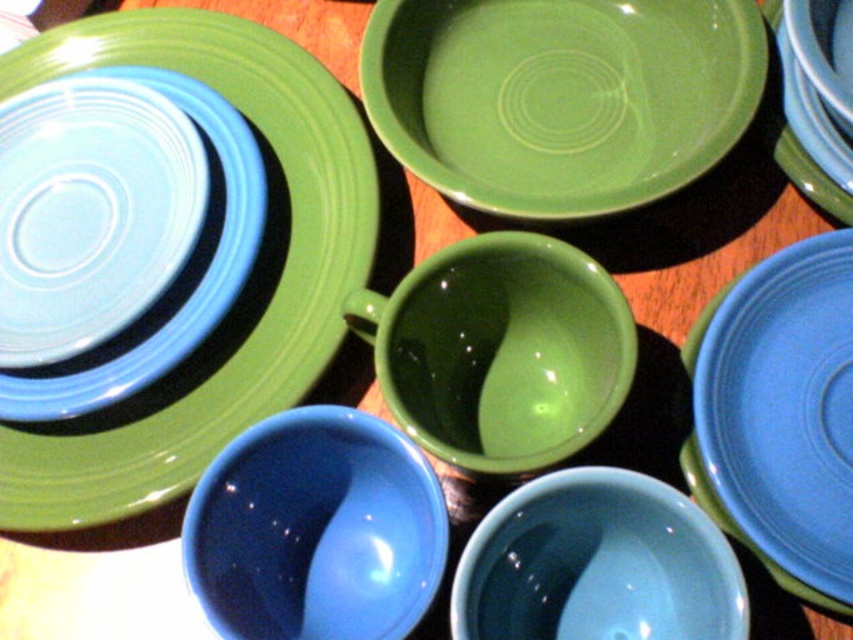
Question: Does blue glossy bowl at lower center appear over glossy ceramic cup at center?

Choices:
 (A) yes
 (B) no

Answer: (B)

Question: Among these points, which one is nearest to the camera?

Choices:
 (A) (206, 317)
 (B) (828, 212)

Answer: (A)

Question: Can you confirm if matte ceramic plate at upper left is wider than matte blue plate at upper left?

Choices:
 (A) yes
 (B) no

Answer: (A)

Question: Which of the following is the closest to the observer?

Choices:
 (A) matte blue plate at right
 (B) matte blue plate at upper left
 (C) blue glossy bowl at lower center

Answer: (C)

Question: Does matte ceramic plate at upper left have a lesser width compared to matte blue bowl at lower center?

Choices:
 (A) yes
 (B) no

Answer: (B)

Question: Among these points, which one is nearest to the camera?

Choices:
 (A) (781, 29)
 (B) (523, 355)
 (C) (704, 378)

Answer: (C)